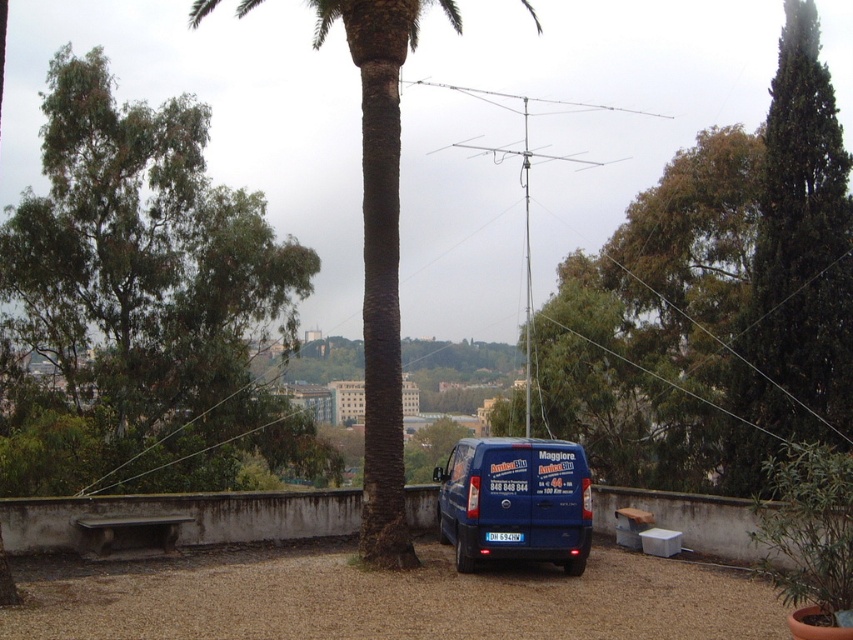
Does green leafy tree at left come behind green textured palm tree at center?

Yes, green leafy tree at left is further from the viewer.

Is point (146, 298) less distant than point (376, 465)?

No, (146, 298) is behind (376, 465).

Find the location of a particular element. green leafy tree at left is located at coordinates pyautogui.click(x=141, y=304).

You are a GUI agent. You are given a task and a screenshot of the screen. Output one action in this format:
    pyautogui.click(x=<x>, y=<y>)
    Task: Click on the green leafy tree at left
    The height and width of the screenshot is (640, 853).
    Given the screenshot: What is the action you would take?
    pyautogui.click(x=141, y=304)

Between green textured palm tree at center and blue matte van at center, which one has less height?

blue matte van at center is shorter.

Is green textured palm tree at center taller than blue matte van at center?

Correct, green textured palm tree at center is much taller as blue matte van at center.

The width and height of the screenshot is (853, 640). What do you see at coordinates (381, 253) in the screenshot?
I see `green textured palm tree at center` at bounding box center [381, 253].

Locate an element on the screen. This screenshot has width=853, height=640. green textured palm tree at center is located at coordinates (381, 253).

Which is behind, point (149, 480) or point (512, 445)?

The point (149, 480) is behind.

The width and height of the screenshot is (853, 640). Describe the element at coordinates (141, 304) in the screenshot. I see `green leafy tree at left` at that location.

Locate an element on the screen. This screenshot has width=853, height=640. green leafy tree at left is located at coordinates coord(141,304).

In order to click on green leafy tree at left in this screenshot , I will do (141, 304).